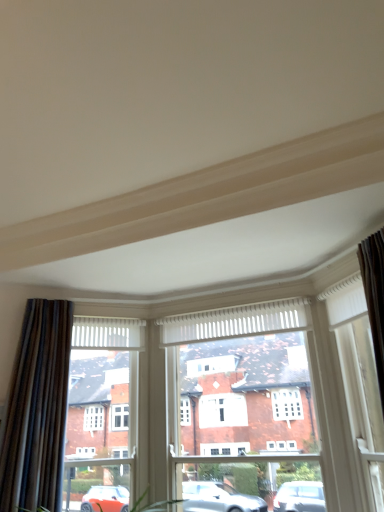
Question: Are white wood window frame at center and white wood frame at right making contact?

Choices:
 (A) no
 (B) yes

Answer: (A)

Question: From a real-world perspective, is white wood window frame at center positioned over white wood frame at right based on gravity?

Choices:
 (A) yes
 (B) no

Answer: (B)

Question: Can you confirm if white wood window frame at center is smaller than white wood frame at right?

Choices:
 (A) no
 (B) yes

Answer: (A)

Question: From the image's perspective, does white wood window frame at center appear lower than white wood frame at right?

Choices:
 (A) no
 (B) yes

Answer: (B)

Question: Does white wood window frame at center have a greater width compared to white wood frame at right?

Choices:
 (A) no
 (B) yes

Answer: (B)

Question: From the image's perspective, is white wood window frame at center on white wood frame at right?

Choices:
 (A) no
 (B) yes

Answer: (A)

Question: Would you say white wood frame at right is outside dark brown textured curtain at left?

Choices:
 (A) no
 (B) yes

Answer: (B)

Question: Would you say white wood frame at right is a long distance from dark brown textured curtain at left?

Choices:
 (A) yes
 (B) no

Answer: (A)

Question: Could dark brown textured curtain at left be considered to be inside white wood frame at right?

Choices:
 (A) yes
 (B) no

Answer: (B)

Question: Does white wood frame at right have a lesser width compared to dark brown textured curtain at left?

Choices:
 (A) no
 (B) yes

Answer: (B)

Question: From the image's perspective, is white wood frame at right located beneath dark brown textured curtain at left?

Choices:
 (A) no
 (B) yes

Answer: (A)

Question: Can you confirm if white wood frame at right is wider than dark brown textured curtain at left?

Choices:
 (A) yes
 (B) no

Answer: (B)

Question: From a real-world perspective, is white wood frame at right under white wood window frame at center?

Choices:
 (A) yes
 (B) no

Answer: (B)